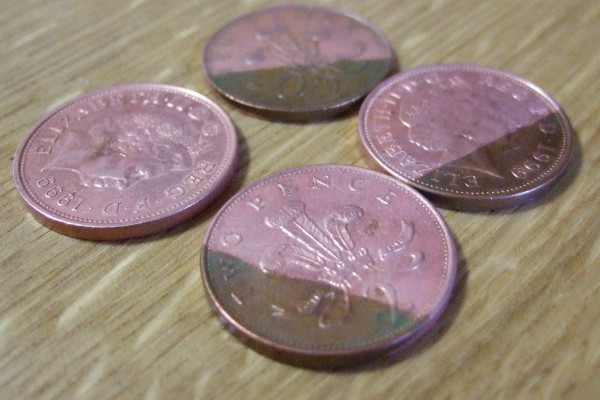
Where is `wooden table`? This screenshot has width=600, height=400. wooden table is located at coordinates (83, 320).